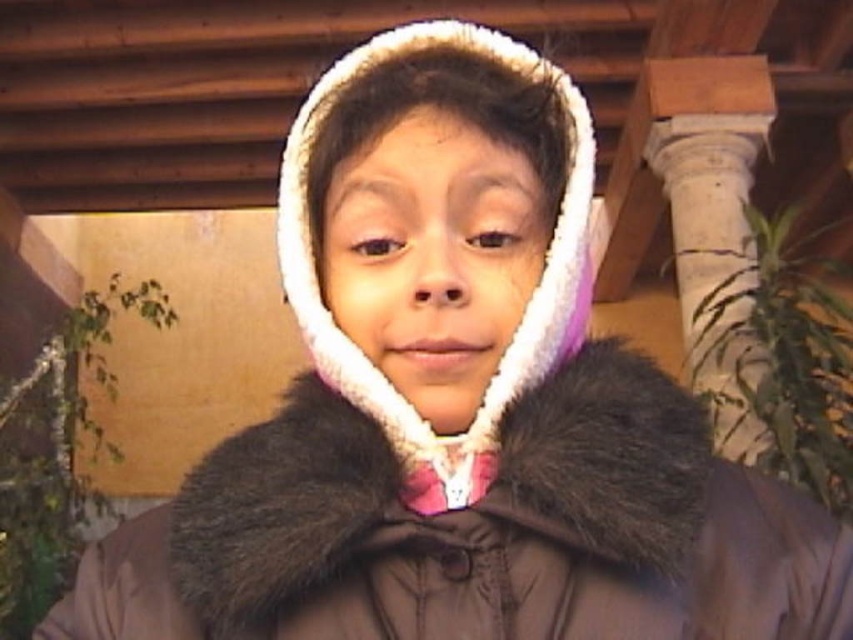
You are designing a layout for a cozy winter photo shoot. The scene requires placing a white fur at center and a white stone column at upper right. Given their sizes, which object should be placed closer to the camera to maintain visual balance?

The white fur at center should be placed closer to the camera since it is smaller than the white stone column at upper right, helping to balance their sizes in the composition.